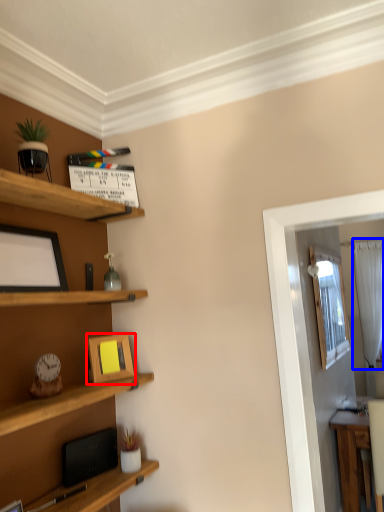
Question: Which object appears farthest to the camera in this image, picture frame (highlighted by a red box) or curtain (highlighted by a blue box)?

Choices:
 (A) picture frame
 (B) curtain

Answer: (B)